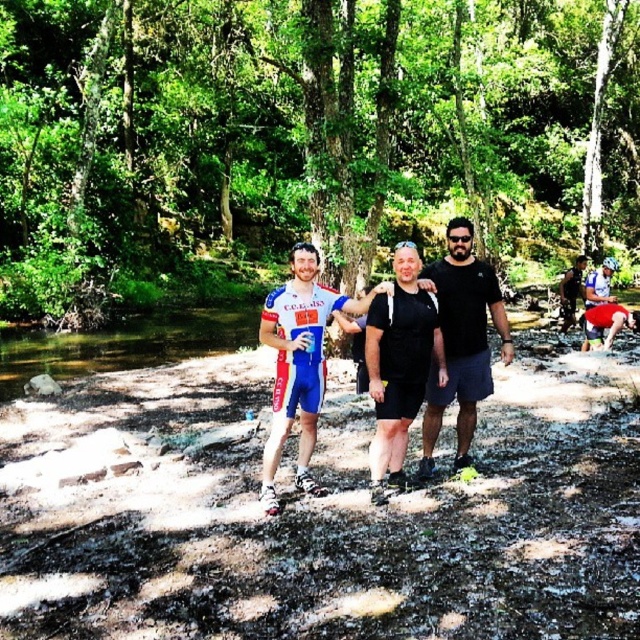
Question: Which of these objects is positioned farthest from the blue cycling jersey at center?

Choices:
 (A) blue fabric shorts at center
 (B) black matte t-shirt at center
 (C) matte blue shorts at center

Answer: (A)

Question: Is matte blue shorts at center positioned at the back of black matte shorts at center?

Choices:
 (A) no
 (B) yes

Answer: (A)

Question: Which is farther from the blue fabric shorts at center?

Choices:
 (A) green leafy forest at center
 (B) black matte t-shirt at center
 (C) black matte shorts at center
 (D) blue cycling jersey at center

Answer: (A)

Question: Is black matte shorts at center bigger than blue fabric shorts at center?

Choices:
 (A) yes
 (B) no

Answer: (B)

Question: Is black matte t-shirt at center behind blue cycling jersey at center?

Choices:
 (A) yes
 (B) no

Answer: (A)

Question: Which is nearer to the black matte t-shirt at center?

Choices:
 (A) blue fabric shorts at center
 (B) green leafy forest at center
 (C) black matte shorts at center
 (D) blue cycling jersey at center

Answer: (C)